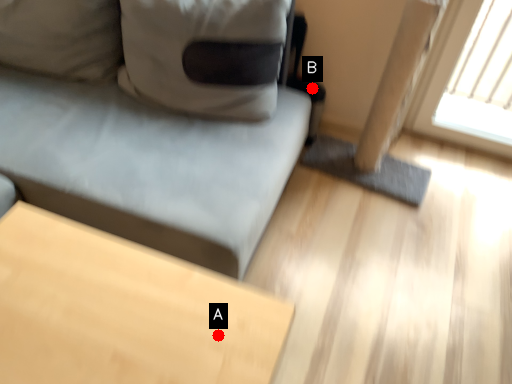
Question: Two points are circled on the image, labeled by A and B beside each circle. Which point is farther from the camera taking this photo?

Choices:
 (A) A is further
 (B) B is further

Answer: (B)